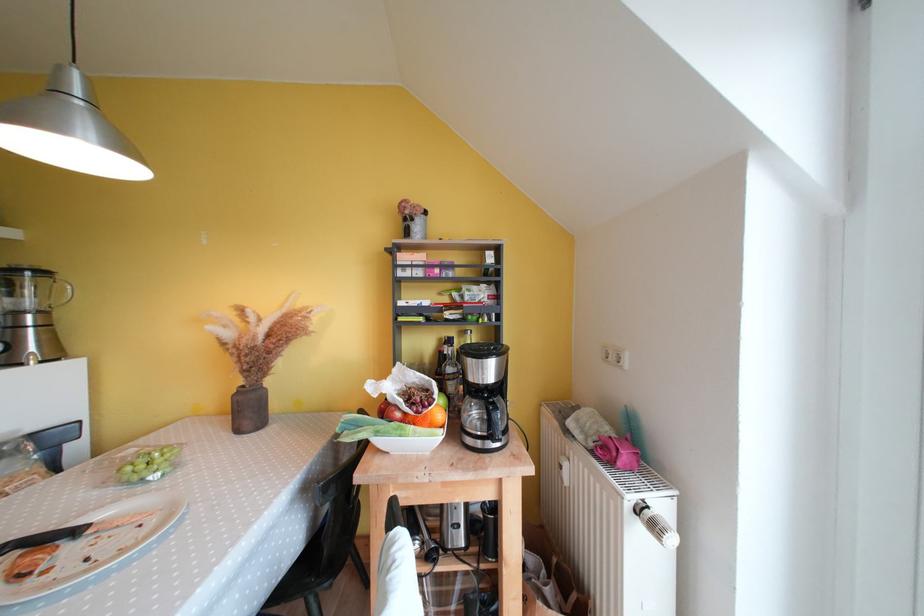
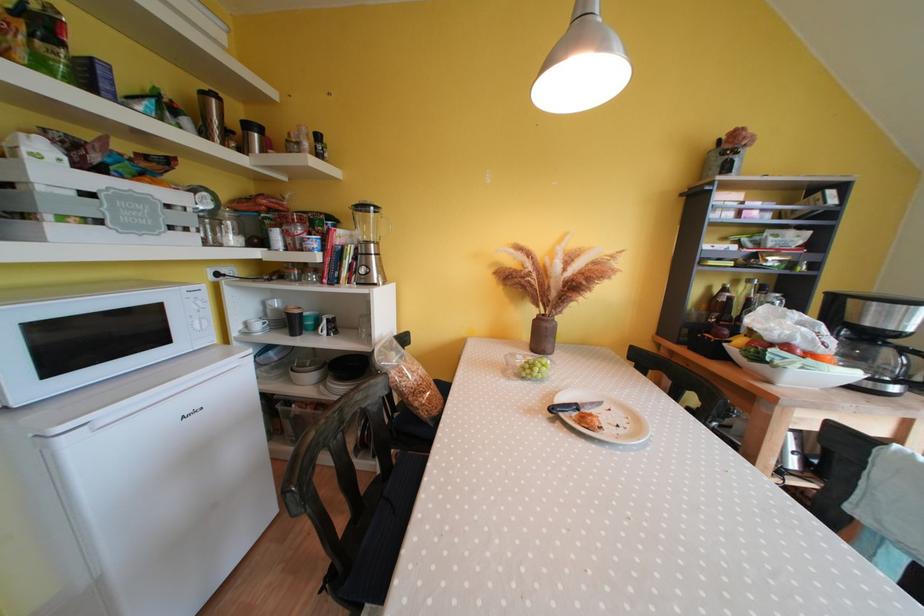
Question: What movement of the cameraman would produce the second image?

Choices:
 (A) Left
 (B) Right
 (C) Forward
 (D) Backward

Answer: (A)